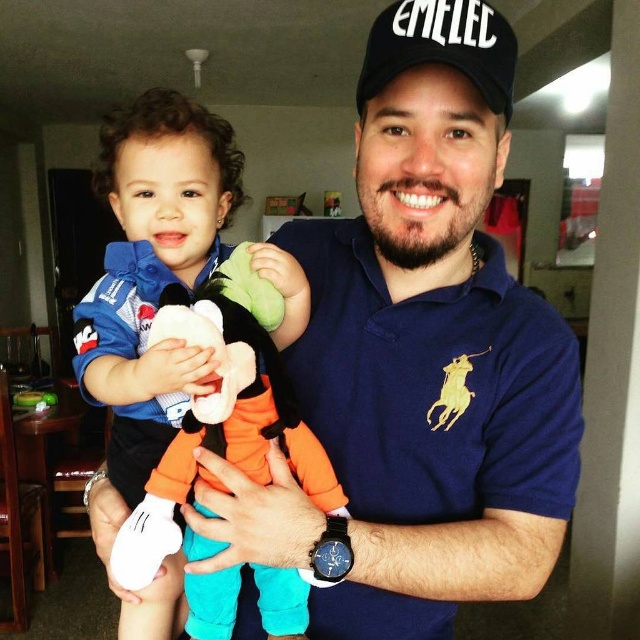
Consider the image. Can you confirm if soft plush toy at center is positioned to the left of black fabric cap at upper center?

Indeed, soft plush toy at center is positioned on the left side of black fabric cap at upper center.

Can you confirm if soft plush toy at center is positioned to the right of black fabric cap at upper center?

No, soft plush toy at center is not to the right of black fabric cap at upper center.

Is point (296, 316) farther from camera compared to point (493, 38)?

Yes, it is behind point (493, 38).

At what (x,y) coordinates should I click in order to perform the action: click on soft plush toy at center. Please return your answer as a coordinate pair (x, y). Looking at the image, I should click on (150, 276).